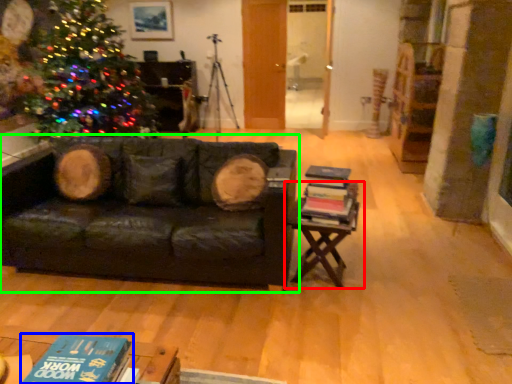
Question: Based on their relative distances, which object is nearer to table (highlighted by a red box)? Choose from book (highlighted by a blue box) and studio couch (highlighted by a green box).

Choices:
 (A) book
 (B) studio couch

Answer: (B)